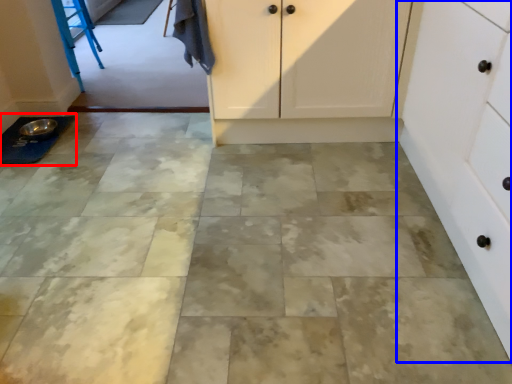
Question: Which point is further to the camera, sink (highlighted by a red box) or cabinetry (highlighted by a blue box)?

Choices:
 (A) sink
 (B) cabinetry

Answer: (A)